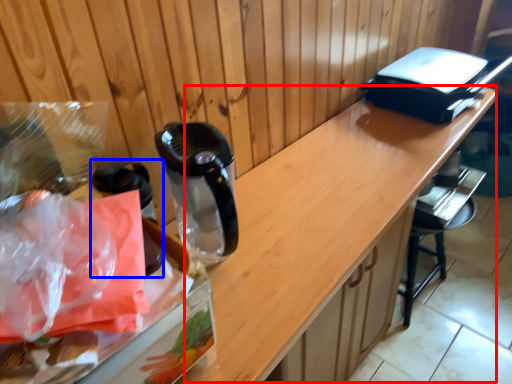
Question: Which object appears farthest to the camera in this image, counter (highlighted by a red box) or appliance (highlighted by a blue box)?

Choices:
 (A) counter
 (B) appliance

Answer: (B)